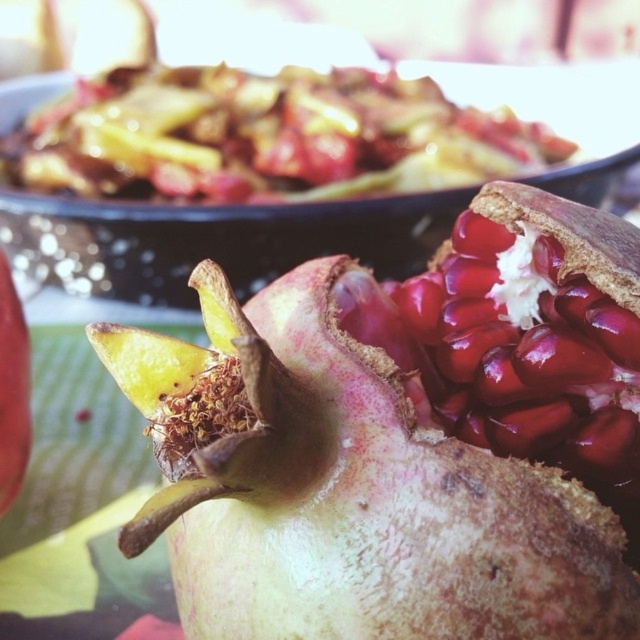
Question: Which of the following is the farthest from the observer?

Choices:
 (A) coord(445,486)
 (B) coord(436,179)

Answer: (B)

Question: Which point is farther to the camera?

Choices:
 (A) (294, 502)
 (B) (513, 136)

Answer: (B)

Question: Does greenish-brown textured pomegranate at center have a larger size compared to shiny red pomegranate at center?

Choices:
 (A) no
 (B) yes

Answer: (A)

Question: Is greenish-brown textured pomegranate at center further to camera compared to shiny red pomegranate at center?

Choices:
 (A) yes
 (B) no

Answer: (B)

Question: Is greenish-brown textured pomegranate at center closer to the viewer compared to shiny red pomegranate at center?

Choices:
 (A) no
 (B) yes

Answer: (B)